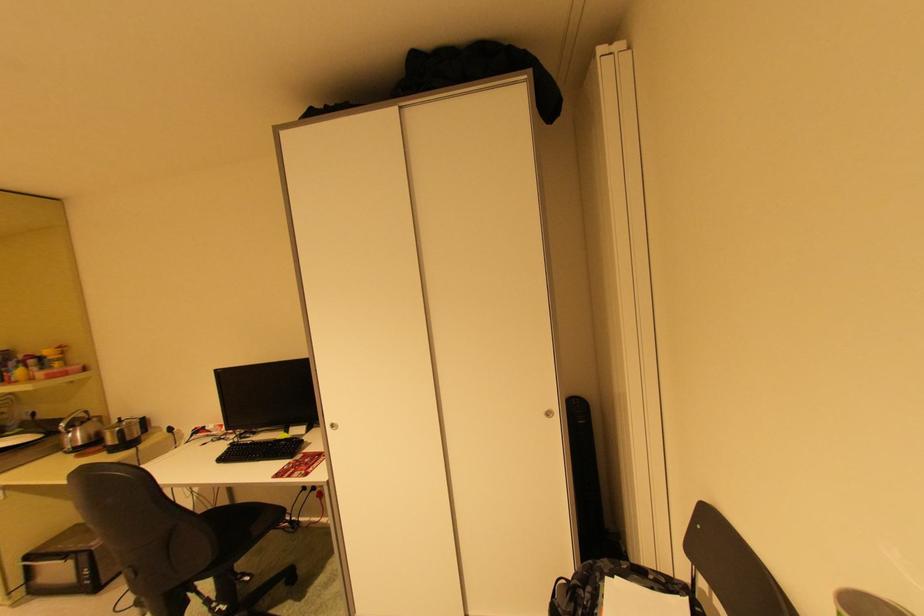
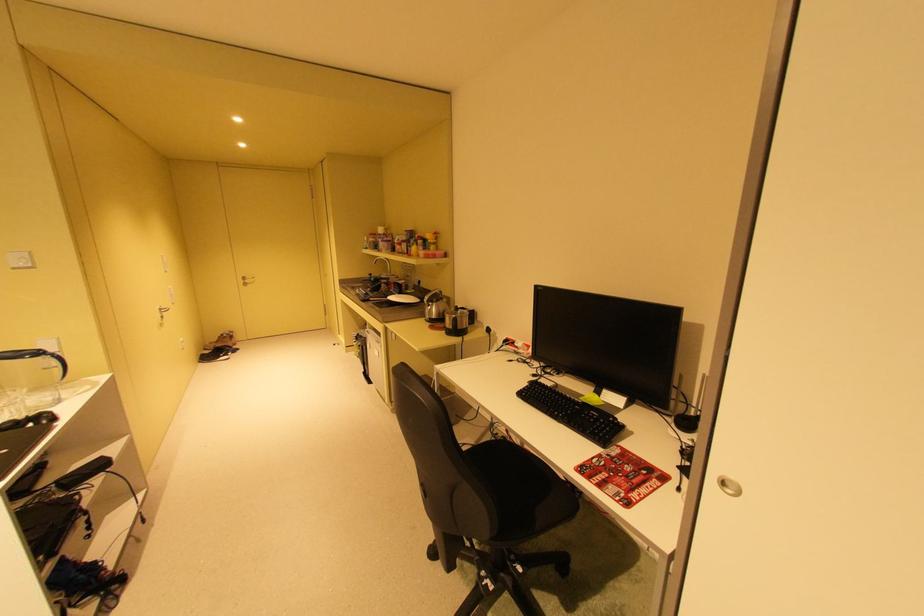
The images are taken continuously from a first-person perspective. In which direction is your viewpoint rotating?

The camera's rotation is toward left-down.